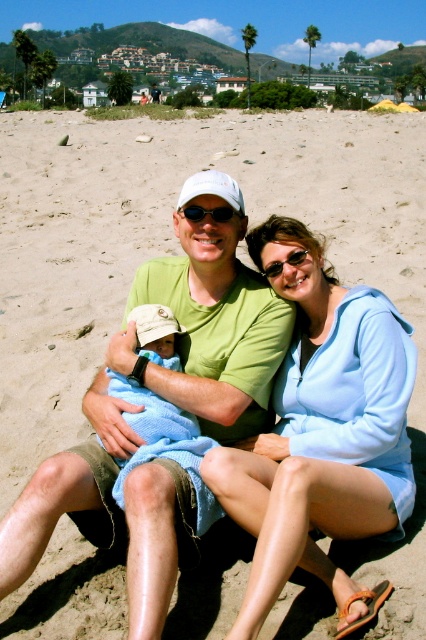
Question: Can you confirm if green matte shirt at center is positioned to the right of blue knitted blanket at center?

Choices:
 (A) yes
 (B) no

Answer: (A)

Question: Which object is positioned farthest from the blue knitted blanket at center?

Choices:
 (A) green matte shirt at center
 (B) light blue hoodie at center

Answer: (B)

Question: Which object appears farthest from the camera in this image?

Choices:
 (A) light blue hoodie at center
 (B) blue knitted blanket at center

Answer: (B)

Question: Is the position of light blue hoodie at center more distant than that of blue knitted blanket at center?

Choices:
 (A) yes
 (B) no

Answer: (B)

Question: Among these points, which one is nearest to the camera?

Choices:
 (A) (166, 349)
 (B) (250, 380)

Answer: (B)

Question: Is light blue hoodie at center positioned behind blue knitted blanket at center?

Choices:
 (A) yes
 (B) no

Answer: (B)